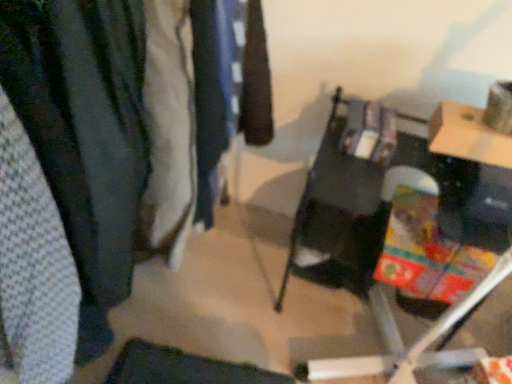
Locate an element on the screen. matte black table at center is located at coordinates (380, 204).

The width and height of the screenshot is (512, 384). What do you see at coordinates (33, 266) in the screenshot? I see `white textured fabric at left, which is the 2th clothing in back-to-front order` at bounding box center [33, 266].

The height and width of the screenshot is (384, 512). What are the coordinates of `white textured fabric at left, the first clothing viewed from the left` in the screenshot? It's located at (33, 266).

What are the coordinates of `dark blue fabric at center, which is the 1th clothing from back to front` in the screenshot? It's located at (213, 94).

Considering the positions of point (15, 141) and point (225, 51), is point (15, 141) closer or farther from the camera than point (225, 51)?

Clearly, point (15, 141) is closer to the camera than point (225, 51).

Consider the image. Are white textured fabric at left, marked as the second clothing in a right-to-left arrangement, and dark blue fabric at center, arranged as the second clothing when viewed from the left, making contact?

They are not placed beside each other.

Considering the sizes of objects white textured fabric at left, which is the 2th clothing in back-to-front order, and dark blue fabric at center, arranged as the second clothing when viewed from the left, in the image provided, who is shorter, white textured fabric at left, which is the 2th clothing in back-to-front order, or dark blue fabric at center, arranged as the second clothing when viewed from the left,?

Standing shorter between the two is white textured fabric at left, which is the 2th clothing in back-to-front order.

Which object is positioned more to the right, white textured fabric at left, which is the 2th clothing in back-to-front order, or dark blue fabric at center, acting as the 1th clothing starting from the right?

From the viewer's perspective, dark blue fabric at center, acting as the 1th clothing starting from the right, appears more on the right side.

Is white textured fabric at left, the first clothing viewed from the left, positioned far away from matte black table at center?

No, white textured fabric at left, the first clothing viewed from the left, is not far away from matte black table at center.

Considering the positions of point (7, 241) and point (390, 206), is point (7, 241) closer or farther from the camera than point (390, 206)?

Clearly, point (7, 241) is closer to the camera than point (390, 206).

From a real-world perspective, who is located lower, white textured fabric at left, marked as the second clothing in a right-to-left arrangement, or matte black table at center?

From a 3D spatial view, matte black table at center is below.

Considering the positions of objects white textured fabric at left, which is the 1th clothing in front-to-back order, and matte black table at center in the image provided, who is more to the right, white textured fabric at left, which is the 1th clothing in front-to-back order, or matte black table at center?

matte black table at center is more to the right.

In the scene shown: Considering the relative sizes of white textured fabric at left, marked as the second clothing in a right-to-left arrangement, and textured fabric closet at left in the image provided, is white textured fabric at left, marked as the second clothing in a right-to-left arrangement, smaller than textured fabric closet at left?

Yes, white textured fabric at left, marked as the second clothing in a right-to-left arrangement, is smaller than textured fabric closet at left.

Could you tell me if white textured fabric at left, the first clothing viewed from the left, is turned towards textured fabric closet at left?

No, white textured fabric at left, the first clothing viewed from the left, is not facing towards textured fabric closet at left.

The height and width of the screenshot is (384, 512). I want to click on closet behind the white textured fabric at left, which is the 1th clothing in front-to-back order, so click(x=84, y=134).

From the image's perspective, is white textured fabric at left, which is the 2th clothing in back-to-front order, above textured fabric closet at left?

Actually, white textured fabric at left, which is the 2th clothing in back-to-front order, appears below textured fabric closet at left in the image.

Locate an element on the screen. The width and height of the screenshot is (512, 384). clothing below the dark blue fabric at center, acting as the 1th clothing starting from the right (from the image's perspective) is located at coordinates (33, 266).

Would you say dark blue fabric at center, arranged as the second clothing when viewed from the left, is outside white textured fabric at left, which is the 2th clothing in back-to-front order?

dark blue fabric at center, arranged as the second clothing when viewed from the left, lies outside white textured fabric at left, which is the 2th clothing in back-to-front order,'s area.

Considering the positions of objects dark blue fabric at center, which ranks as the second clothing in front-to-back order, and white textured fabric at left, the first clothing viewed from the left, in the image provided, who is more to the right, dark blue fabric at center, which ranks as the second clothing in front-to-back order, or white textured fabric at left, the first clothing viewed from the left,?

Positioned to the right is dark blue fabric at center, which ranks as the second clothing in front-to-back order.

Considering the points (211, 134) and (368, 191), which point is behind, point (211, 134) or point (368, 191)?

The point (368, 191) is farther.

From the image's perspective, who appears lower, dark blue fabric at center, arranged as the second clothing when viewed from the left, or matte black table at center?

matte black table at center is shown below in the image.

Which object is further away from the camera taking this photo, dark blue fabric at center, arranged as the second clothing when viewed from the left, or matte black table at center?

matte black table at center is further away from the camera.

In terms of size, does textured fabric closet at left appear bigger or smaller than white textured fabric at left, which is the 2th clothing in back-to-front order?

textured fabric closet at left is bigger than white textured fabric at left, which is the 2th clothing in back-to-front order.

How different are the orientations of textured fabric closet at left and white textured fabric at left, which is the 1th clothing in front-to-back order, in degrees?

textured fabric closet at left and white textured fabric at left, which is the 1th clothing in front-to-back order, are facing 0.00128 degrees away from each other.

Is textured fabric closet at left in front of or behind white textured fabric at left, which is the 1th clothing in front-to-back order, in the image?

Clearly, textured fabric closet at left is behind white textured fabric at left, which is the 1th clothing in front-to-back order.

Is matte black table at center facing towards white textured fabric at left, marked as the second clothing in a right-to-left arrangement?

No, matte black table at center is not oriented towards white textured fabric at left, marked as the second clothing in a right-to-left arrangement.

From the image's perspective, between matte black table at center and white textured fabric at left, marked as the second clothing in a right-to-left arrangement, which one is located above?

white textured fabric at left, marked as the second clothing in a right-to-left arrangement.

Between point (442, 199) and point (23, 163), which one is positioned in front?

The point (23, 163) is in front.

Is the position of matte black table at center less distant than that of white textured fabric at left, which is the 2th clothing in back-to-front order?

No, the depth of matte black table at center is greater than that of white textured fabric at left, which is the 2th clothing in back-to-front order.

Image resolution: width=512 pixels, height=384 pixels. Identify the location of clothing on the left of dark blue fabric at center, acting as the 1th clothing starting from the right. (33, 266).

Find the location of `furniture below the white textured fabric at left, the first clothing viewed from the left (from the image's perspective)`. furniture below the white textured fabric at left, the first clothing viewed from the left (from the image's perspective) is located at coordinates (380, 204).

Estimate the real-world distances between objects in this image. Which object is further from dark blue fabric at center, which is the 1th clothing from back to front, white textured fabric at left, the first clothing viewed from the left, or matte black table at center?

white textured fabric at left, the first clothing viewed from the left, is further to dark blue fabric at center, which is the 1th clothing from back to front.

Looking at the image, which one is located further to dark blue fabric at center, acting as the 1th clothing starting from the right, white textured fabric at left, the first clothing viewed from the left, or textured fabric closet at left?

white textured fabric at left, the first clothing viewed from the left, is further to dark blue fabric at center, acting as the 1th clothing starting from the right.

Estimate the real-world distances between objects in this image. Which object is further from matte black table at center, dark blue fabric at center, arranged as the second clothing when viewed from the left, or white textured fabric at left, the first clothing viewed from the left?

Among the two, white textured fabric at left, the first clothing viewed from the left, is located further to matte black table at center.

From the image, which object appears to be farther from dark blue fabric at center, arranged as the second clothing when viewed from the left, textured fabric closet at left or matte black table at center?

matte black table at center lies further to dark blue fabric at center, arranged as the second clothing when viewed from the left, than the other object.

From the picture: Looking at the image, which one is located closer to white textured fabric at left, marked as the second clothing in a right-to-left arrangement, textured fabric closet at left or matte black table at center?

textured fabric closet at left.

Which object lies nearer to the anchor point textured fabric closet at left, matte black table at center or white textured fabric at left, which is the 1th clothing in front-to-back order?

white textured fabric at left, which is the 1th clothing in front-to-back order, lies closer to textured fabric closet at left than the other object.

Looking at the image, which one is located closer to white textured fabric at left, the first clothing viewed from the left, matte black table at center or dark blue fabric at center, acting as the 1th clothing starting from the right?

Based on the image, dark blue fabric at center, acting as the 1th clothing starting from the right, appears to be nearer to white textured fabric at left, the first clothing viewed from the left.

Considering their positions, is matte black table at center positioned closer to white textured fabric at left, marked as the second clothing in a right-to-left arrangement, than textured fabric closet at left?

textured fabric closet at left is positioned closer to the anchor white textured fabric at left, marked as the second clothing in a right-to-left arrangement.

In order to click on closet located between white textured fabric at left, which is the 2th clothing in back-to-front order, and matte black table at center in the left-right direction in this screenshot , I will do `click(84, 134)`.

Where is `clothing situated between white textured fabric at left, which is the 2th clothing in back-to-front order, and matte black table at center from left to right`? Image resolution: width=512 pixels, height=384 pixels. clothing situated between white textured fabric at left, which is the 2th clothing in back-to-front order, and matte black table at center from left to right is located at coordinates (213, 94).

The width and height of the screenshot is (512, 384). I want to click on closet positioned between white textured fabric at left, the first clothing viewed from the left, and dark blue fabric at center, arranged as the second clothing when viewed from the left, from near to far, so click(x=84, y=134).

I want to click on clothing located between textured fabric closet at left and matte black table at center in the left-right direction, so click(213, 94).